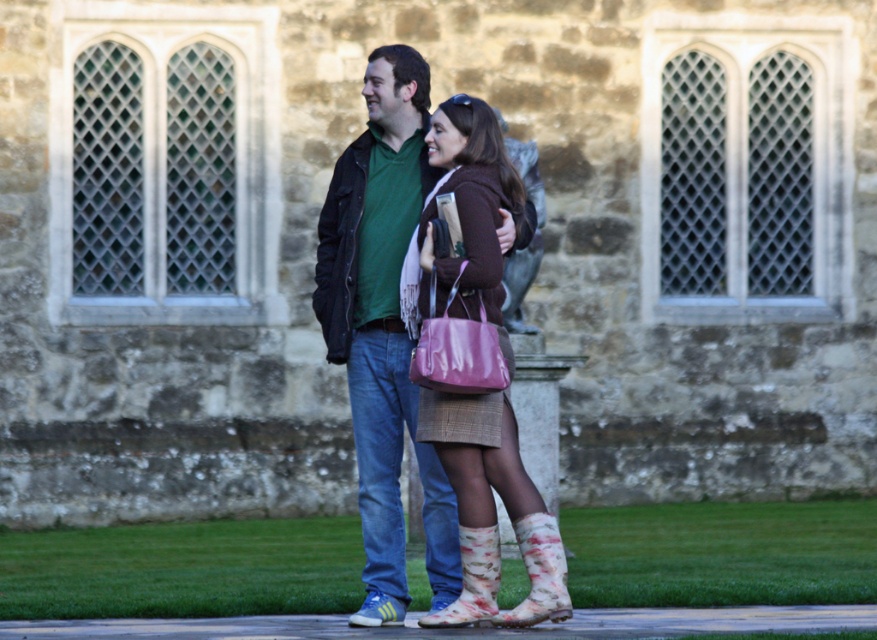
Question: Does matte green shirt at center appear under matte pink purse at center?

Choices:
 (A) yes
 (B) no

Answer: (B)

Question: Does floral fabric boot at lower center have a smaller size compared to floral rubber boot at lower center?

Choices:
 (A) yes
 (B) no

Answer: (B)

Question: Which object appears closest to the camera in this image?

Choices:
 (A) floral rubber boot at lower center
 (B) matte pink purse at center
 (C) floral fabric boot at lower center
 (D) matte green shirt at center

Answer: (C)

Question: Among these objects, which one is nearest to the camera?

Choices:
 (A) floral fabric boot at lower center
 (B) matte green shirt at center

Answer: (A)

Question: Among these points, which one is farthest from the camera?

Choices:
 (A) (469, 584)
 (B) (379, 49)
 (C) (567, 570)

Answer: (B)

Question: Considering the relative positions of floral fabric boot at lower center and floral rubber boot at lower center in the image provided, where is floral fabric boot at lower center located with respect to floral rubber boot at lower center?

Choices:
 (A) below
 (B) above

Answer: (B)